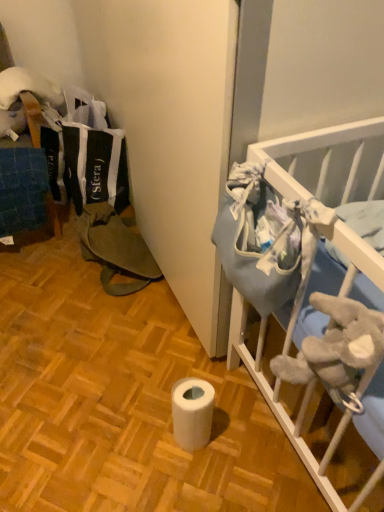
The image size is (384, 512). Find the location of `white matte toilet paper at center`. white matte toilet paper at center is located at coordinates (192, 412).

Image resolution: width=384 pixels, height=512 pixels. What do you see at coordinates (192, 412) in the screenshot? I see `white matte toilet paper at center` at bounding box center [192, 412].

In order to click on white matte toilet paper at center in this screenshot , I will do `click(192, 412)`.